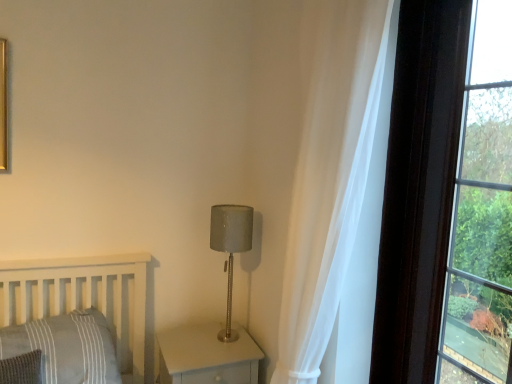
The width and height of the screenshot is (512, 384). What are the coordinates of `unoccupied area in front of satin gray lampshade at center` in the screenshot? It's located at (210, 363).